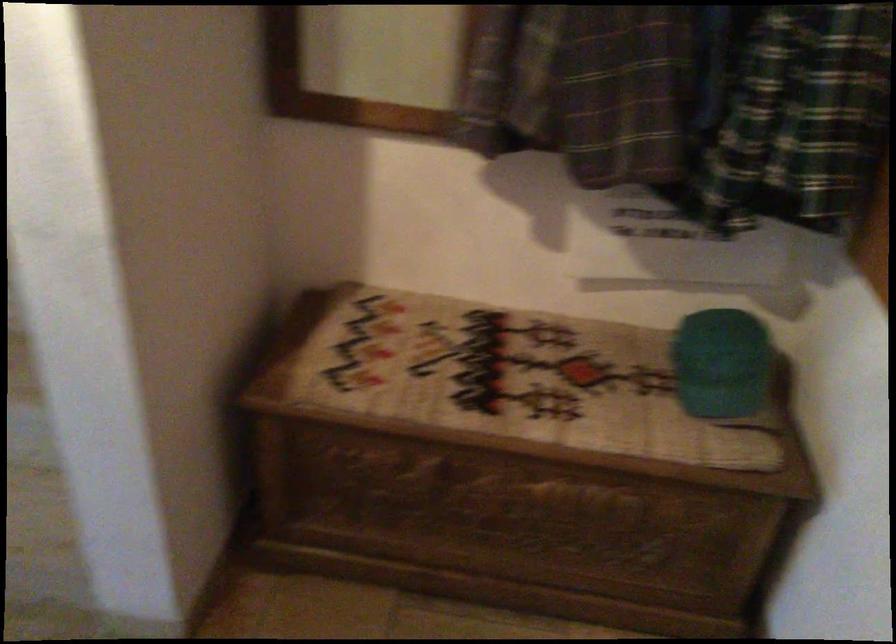
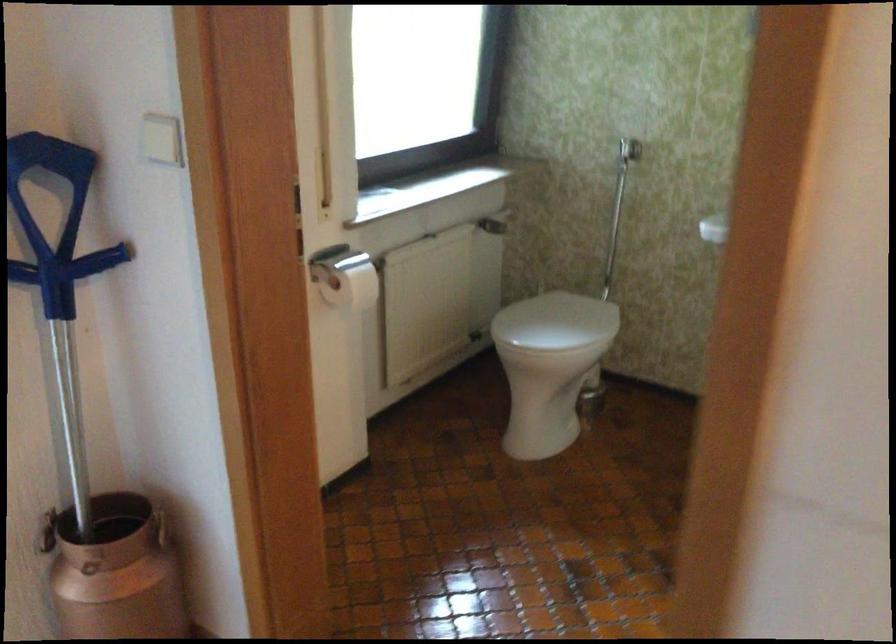
Question: What movement of the cameraman would produce the second image?

Choices:
 (A) Left
 (B) Right
 (C) Forward
 (D) Backward

Answer: (A)